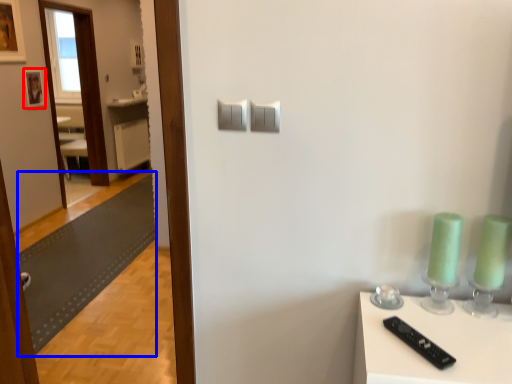
Question: Which of the following is the closest to the observer, picture frame (highlighted by a red box) or mat (highlighted by a blue box)?

Choices:
 (A) picture frame
 (B) mat

Answer: (B)